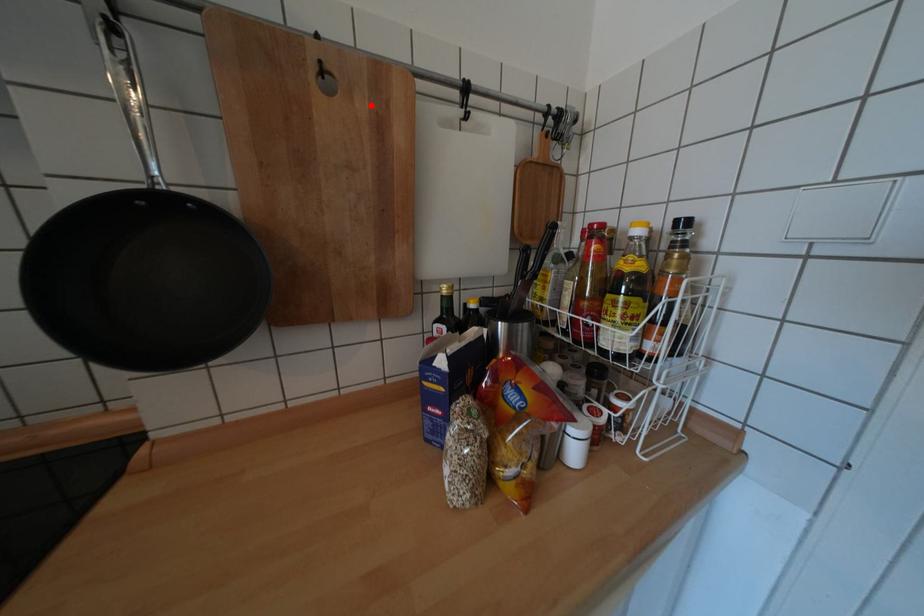
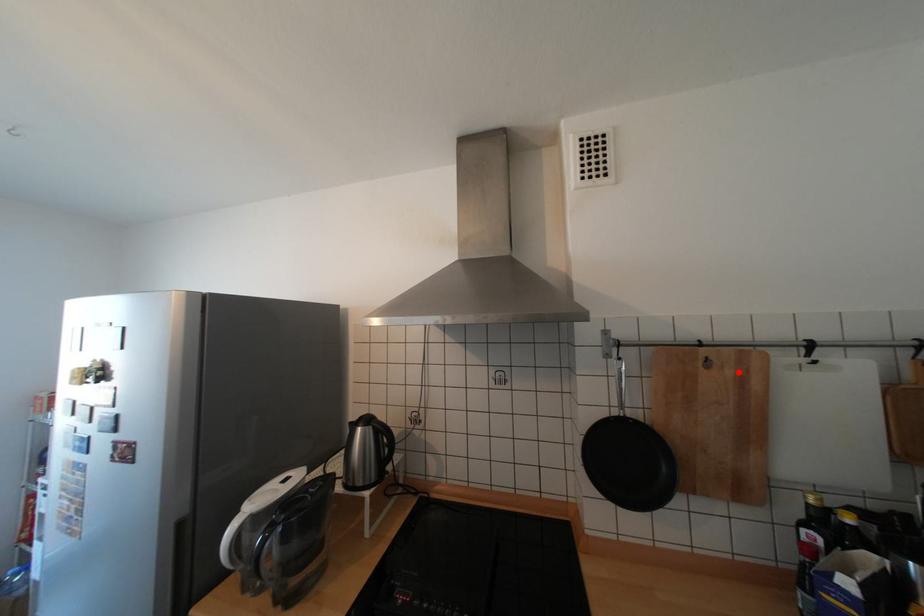
I am providing you with two images of the same scene from different viewpoints. A red point is marked on the first image and another point is marked on the second image. Do the highlighted points in image1 and image2 indicate the same real-world spot?

Yes